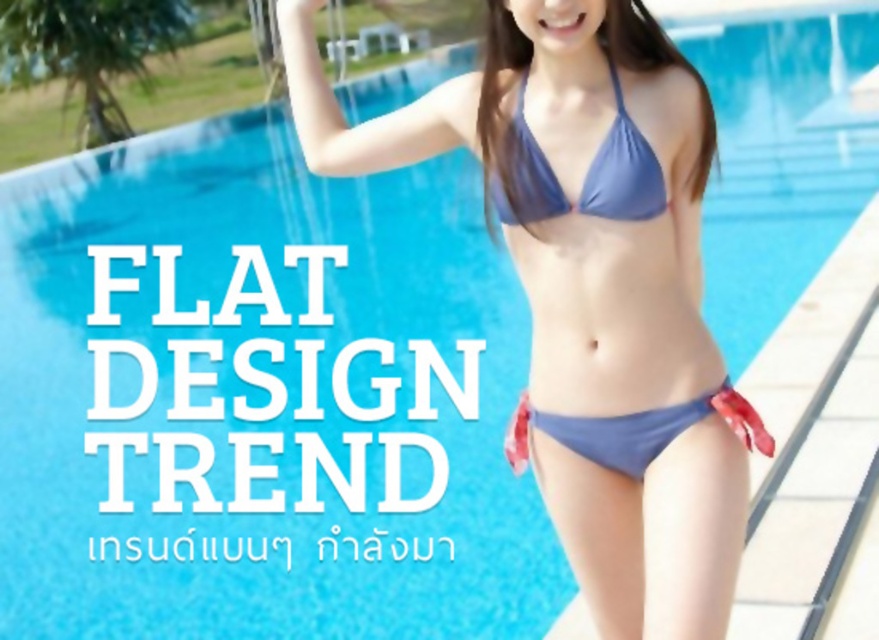
Is blue fabric bikini at upper right behind blue fabric bikini at center?

No, blue fabric bikini at upper right is in front of blue fabric bikini at center.

Which is behind, point (423, 97) or point (609, 166)?

The point (423, 97) is more distant.

The width and height of the screenshot is (879, 640). Find the location of `blue fabric bikini at upper right`. blue fabric bikini at upper right is located at coordinates (590, 289).

Can you confirm if blue fabric bikini at center is wider than matte blue bikini top at center?

Correct, the width of blue fabric bikini at center exceeds that of matte blue bikini top at center.

Does blue fabric bikini at center appear over matte blue bikini top at center?

No.

Identify the location of blue fabric bikini at center. (585, 176).

Does blue fabric bikini at upper right appear under matte blue bikini top at center?

Correct, blue fabric bikini at upper right is located below matte blue bikini top at center.

Is point (663, 492) more distant than point (619, 163)?

Yes, it is behind point (619, 163).

This screenshot has width=879, height=640. Find the location of `blue fabric bikini at upper right`. blue fabric bikini at upper right is located at coordinates (590, 289).

Find the location of `blue fabric bikini at upper right`. blue fabric bikini at upper right is located at coordinates (590, 289).